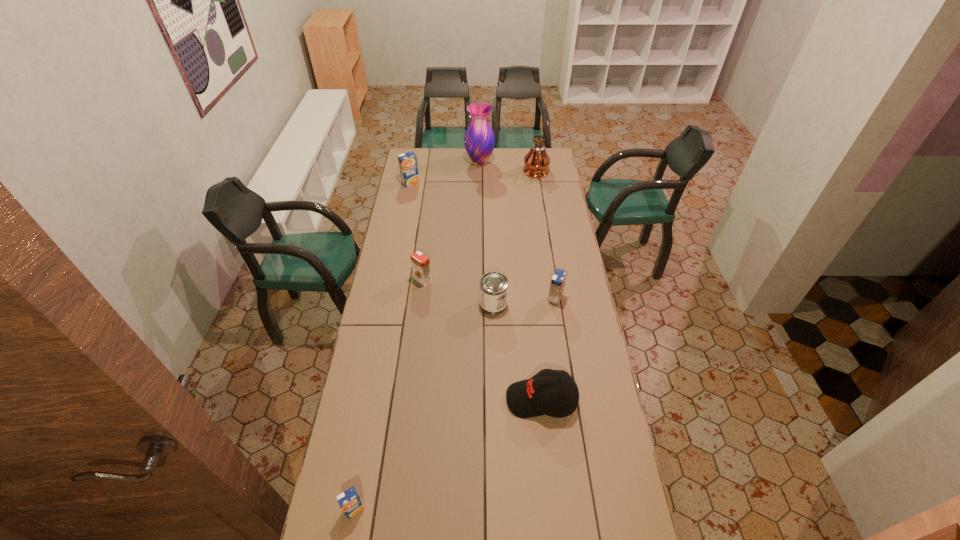
Where is `oil lamp`? The height and width of the screenshot is (540, 960). oil lamp is located at coordinates point(536,161).

Where is `the second tallest object`? the second tallest object is located at coordinates [479, 140].

The image size is (960, 540). In order to click on vase in this screenshot , I will do `click(479, 140)`.

This screenshot has height=540, width=960. Find the location of `the farthest blue orange_juice`. the farthest blue orange_juice is located at coordinates (408, 166).

What are the coordinates of `the tallest orange_juice` in the screenshot? It's located at (408, 166).

Where is `the third farthest orange_juice`? the third farthest orange_juice is located at coordinates (558, 280).

You are a GUI agent. You are given a task and a screenshot of the screen. Output one action in this format:
    pyautogui.click(x=<x>, y=<y>)
    Task: Click on the rightmost orange_juice
    This screenshot has height=540, width=960.
    Given the screenshot: What is the action you would take?
    pyautogui.click(x=558, y=280)

Identify the location of the second farthest orange_juice. The height and width of the screenshot is (540, 960). (420, 263).

In order to click on the sixth object from right to left in this screenshot , I will do `click(420, 263)`.

Find the location of `can`. can is located at coordinates (493, 286).